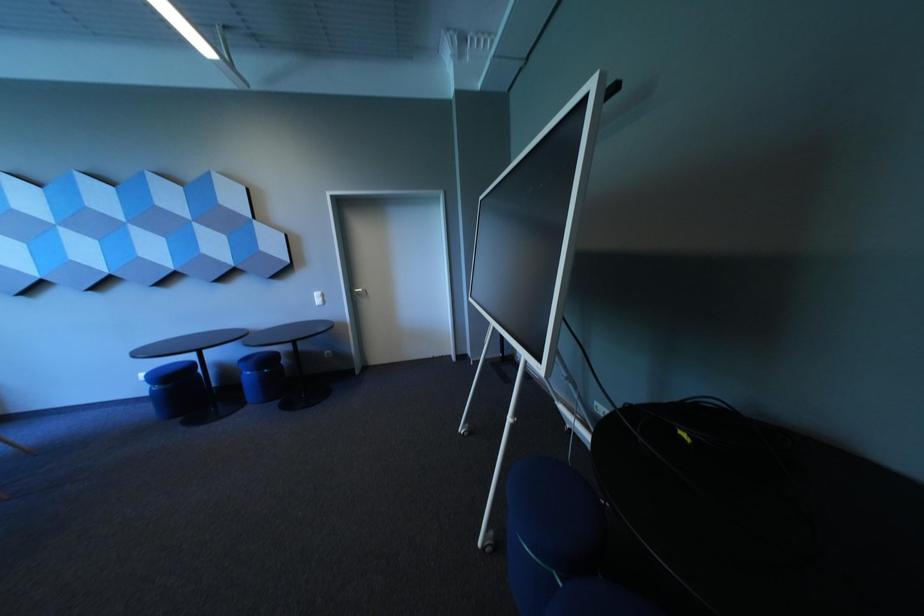
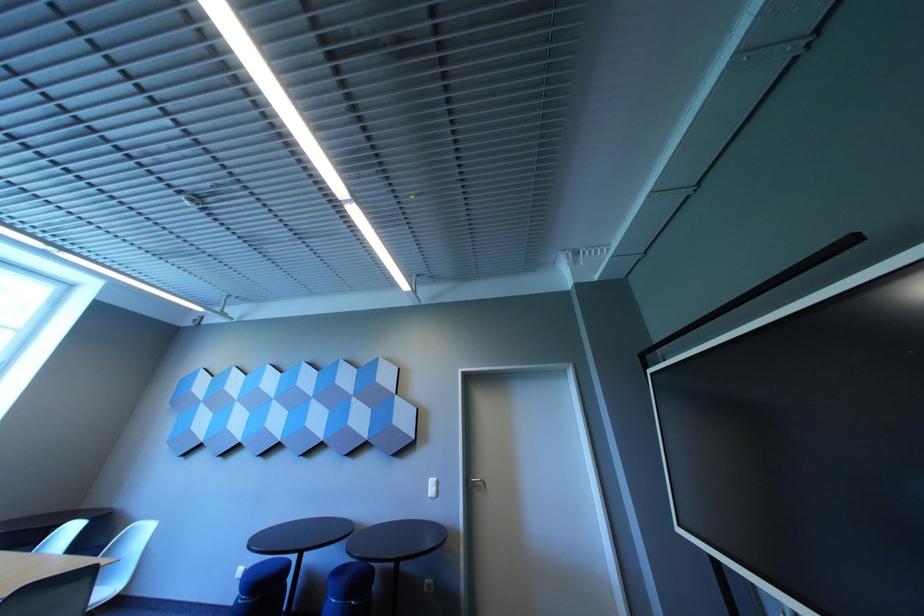
The images are taken continuously from a first-person perspective. In which direction is your viewpoint rotating?

The camera rotated toward left-up.